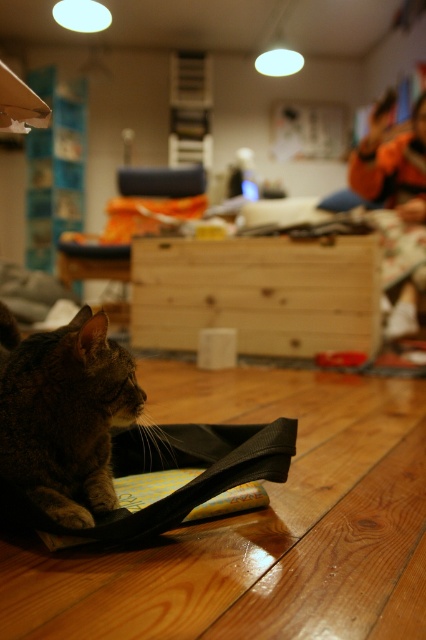
Who is positioned more to the right, natural wood drawer at center or tabby fur cat at center?

natural wood drawer at center is more to the right.

Is point (344, 284) positioned before point (103, 438)?

That is False.

Locate an element on the screen. This screenshot has height=640, width=426. natural wood drawer at center is located at coordinates click(258, 292).